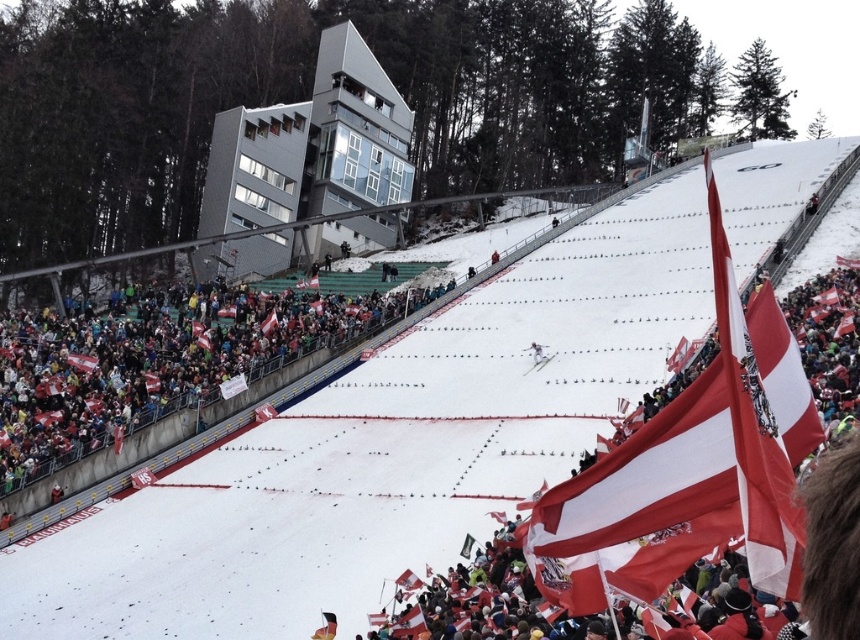
Does point (355, 324) come farther from viewer compared to point (531, 356)?

Yes, point (355, 324) is behind point (531, 356).

Can you confirm if white snow at lower left is positioned above white glossy snowboarder at center?

Indeed, white snow at lower left is positioned over white glossy snowboarder at center.

Image resolution: width=860 pixels, height=640 pixels. Identify the location of white snow at lower left. (152, 365).

Can you confirm if red/white fabric flag at lower right is smaller than white snow at lower left?

No, red/white fabric flag at lower right is not smaller than white snow at lower left.

Is point (797, 595) more distant than point (424, 291)?

No, it is in front of (424, 291).

Is point (674, 500) positioned before point (189, 406)?

Yes, it is.

Locate an element on the screen. red/white fabric flag at lower right is located at coordinates (696, 464).

Who is shorter, red/white fabric flag at lower right or metallic gray building at upper center?

red/white fabric flag at lower right

Identify the location of red/white fabric flag at lower right. (696, 464).

Between point (688, 449) and point (229, 253), which one is positioned in front?

Point (688, 449) is more forward.

In order to click on red/white fabric flag at lower right in this screenshot , I will do `click(696, 464)`.